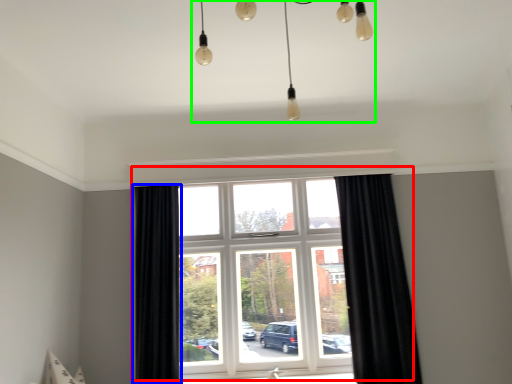
Question: Based on their relative distances, which object is farther from window (highlighted by a red box)? Choose from curtain (highlighted by a blue box) and light fixture (highlighted by a green box).

Choices:
 (A) curtain
 (B) light fixture

Answer: (B)